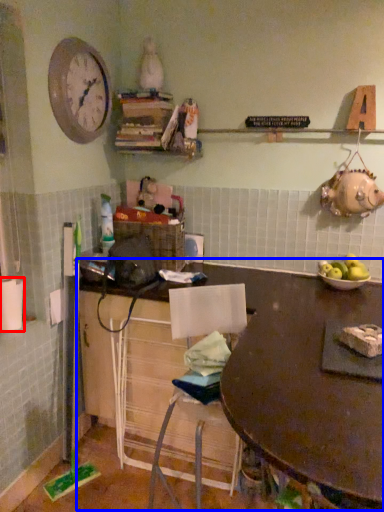
Question: Which object is further to the camera taking this photo, toilet paper (highlighted by a red box) or table (highlighted by a blue box)?

Choices:
 (A) toilet paper
 (B) table

Answer: (A)